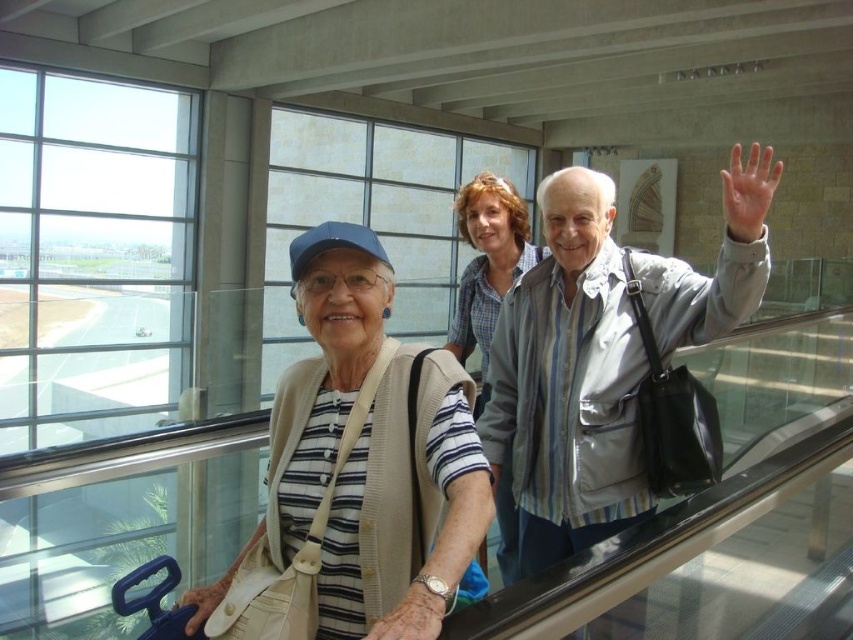
Question: Among these points, which one is farthest from the camera?

Choices:
 (A) (587, 205)
 (B) (491, 269)
 (C) (317, 269)
 (D) (426, 513)

Answer: (B)

Question: Can you confirm if matte beige sweater at center is positioned to the right of plaid shirt at center?

Choices:
 (A) yes
 (B) no

Answer: (B)

Question: Is striped fabric shirt at center further to the viewer compared to gray striped shirt at center?

Choices:
 (A) no
 (B) yes

Answer: (A)

Question: Considering the real-world distances, which object is closest to the matte beige sweater at center?

Choices:
 (A) gray striped shirt at center
 (B) plaid shirt at center
 (C) striped fabric shirt at center

Answer: (C)

Question: Based on their relative distances, which object is farther from the gray striped shirt at center?

Choices:
 (A) striped fabric shirt at center
 (B) plaid shirt at center
 (C) matte beige sweater at center

Answer: (C)

Question: Is matte beige sweater at center further to camera compared to plaid shirt at center?

Choices:
 (A) no
 (B) yes

Answer: (A)